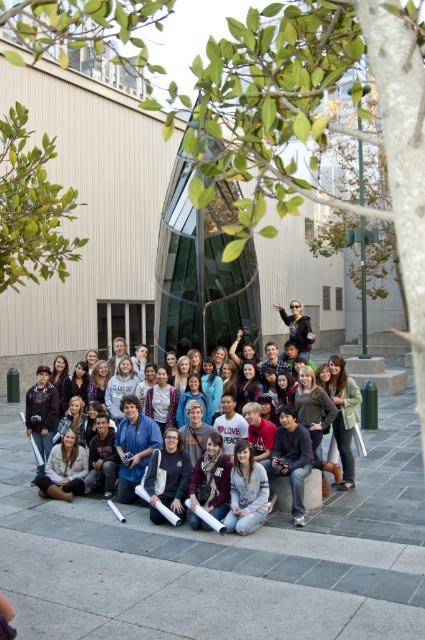
Question: Where is matte black jacket at center located in relation to light blue denim jeans at center in the image?

Choices:
 (A) left
 (B) right

Answer: (B)

Question: Is matte black jacket at center to the right of light blue denim jeans at center from the viewer's perspective?

Choices:
 (A) no
 (B) yes

Answer: (B)

Question: Is matte black jacket at center above light blue denim jeans at center?

Choices:
 (A) no
 (B) yes

Answer: (B)

Question: Which of the following is the farthest from the observer?

Choices:
 (A) (336, 420)
 (B) (263, 490)

Answer: (A)

Question: Among these objects, which one is farthest from the camera?

Choices:
 (A) matte black jacket at center
 (B) light blue denim jeans at center

Answer: (A)